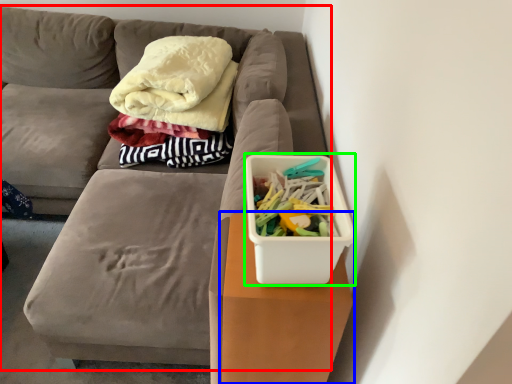
Question: Which object is the closest to the furniture (highlighted by a red box)? Choose among these: table (highlighted by a blue box) or storage box (highlighted by a green box).

Choices:
 (A) table
 (B) storage box

Answer: (A)